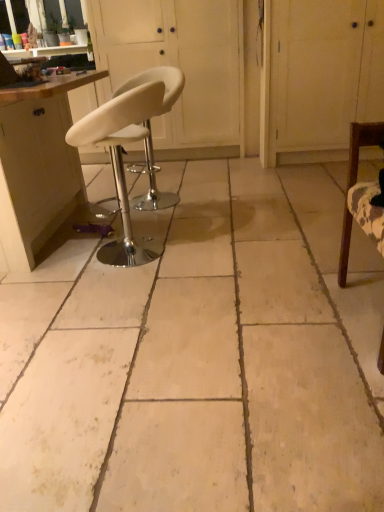
Question: Is matte wood cabinet at left beside white leather stool at center, acting as the 1th chair starting from the left?

Choices:
 (A) no
 (B) yes

Answer: (A)

Question: Is the depth of matte wood cabinet at left less than that of white leather stool at center, the 3th chair positioned from the right?

Choices:
 (A) yes
 (B) no

Answer: (B)

Question: Does matte wood cabinet at left have a larger size compared to white leather stool at center, the 2th chair when ordered from front to back?

Choices:
 (A) no
 (B) yes

Answer: (B)

Question: Does matte wood cabinet at left have a lesser width compared to white leather stool at center, the 2th chair when ordered from front to back?

Choices:
 (A) no
 (B) yes

Answer: (A)

Question: Considering the relative sizes of matte wood cabinet at left and white leather stool at center, acting as the 1th chair starting from the left, in the image provided, is matte wood cabinet at left shorter than white leather stool at center, acting as the 1th chair starting from the left,?

Choices:
 (A) no
 (B) yes

Answer: (A)

Question: Visually, is beige tile floor at center positioned to the left or to the right of white wood cabinet at upper right, positioned as the 2th screen door in left-to-right order?

Choices:
 (A) left
 (B) right

Answer: (A)

Question: Relative to white wood cabinet at upper right, the 1th screen door viewed from the right, is beige tile floor at center in front or behind?

Choices:
 (A) behind
 (B) front

Answer: (B)

Question: In terms of size, does beige tile floor at center appear bigger or smaller than white wood cabinet at upper right, positioned as the 2th screen door in left-to-right order?

Choices:
 (A) big
 (B) small

Answer: (B)

Question: Is beige tile floor at center taller or shorter than white wood cabinet at upper right, positioned as the 2th screen door in left-to-right order?

Choices:
 (A) short
 (B) tall

Answer: (A)

Question: Would you say white wood cabinet at upper right, the 1th screen door viewed from the right, is inside or outside wooden chair at right, the third chair positioned from the left?

Choices:
 (A) outside
 (B) inside

Answer: (A)

Question: From a real-world perspective, relative to wooden chair at right, arranged as the 1th chair when viewed from the right, is white wood cabinet at upper right, positioned as the 2th screen door in left-to-right order, vertically above or below?

Choices:
 (A) below
 (B) above

Answer: (B)

Question: Based on their sizes in the image, would you say white wood cabinet at upper right, the 1th screen door viewed from the right, is bigger or smaller than wooden chair at right, the third chair positioned from the left?

Choices:
 (A) big
 (B) small

Answer: (A)

Question: From the image's perspective, is white wood cabinet at upper right, positioned as the 2th screen door in left-to-right order, located above or below wooden chair at right, the first chair when ordered from front to back?

Choices:
 (A) below
 (B) above

Answer: (B)

Question: Does point [x=152, y=46] appear closer or farther from the camera than point [x=253, y=283]?

Choices:
 (A) farther
 (B) closer

Answer: (A)

Question: Considering the positions of white leather stool at center, the first screen door from the left, and beige tile floor at center in the image, is white leather stool at center, the first screen door from the left, wider or thinner than beige tile floor at center?

Choices:
 (A) wide
 (B) thin

Answer: (B)